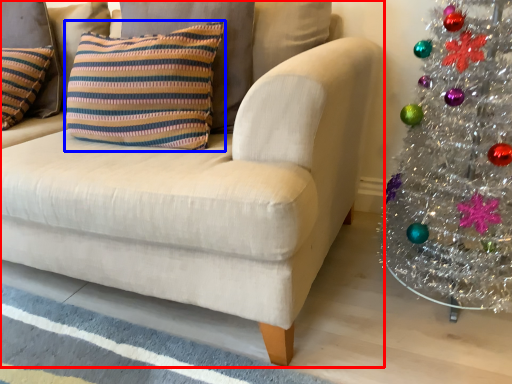
Question: Which object appears closest to the camera in this image, studio couch (highlighted by a red box) or pillow (highlighted by a blue box)?

Choices:
 (A) studio couch
 (B) pillow

Answer: (A)